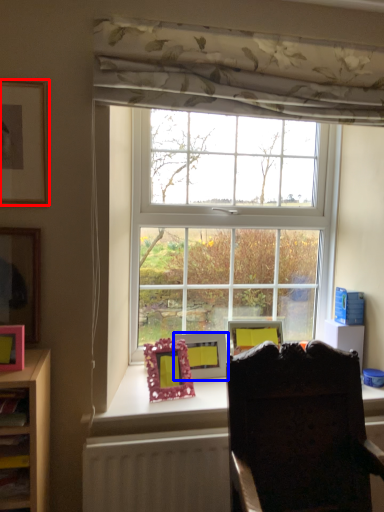
Question: Which point is further to the camera, picture frame (highlighted by a red box) or picture frame (highlighted by a blue box)?

Choices:
 (A) picture frame
 (B) picture frame

Answer: (B)